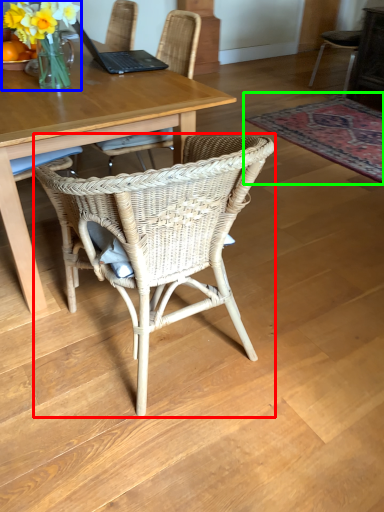
Question: Which is nearer to the chair (highlighted by a red box)? floral arrangement (highlighted by a blue box) or mat (highlighted by a green box).

Choices:
 (A) floral arrangement
 (B) mat

Answer: (A)